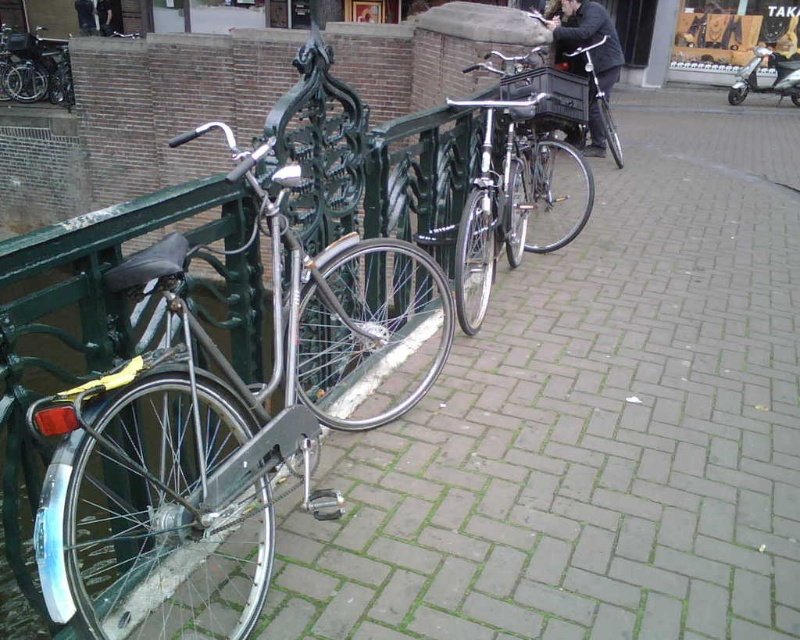
Does shiny silver bicycle at left have a greater width compared to black fabric jacket at upper center?

Correct, the width of shiny silver bicycle at left exceeds that of black fabric jacket at upper center.

Is point (256, 588) less distant than point (600, 120)?

Yes, point (256, 588) is closer to viewer.

Which is in front, point (156, 548) or point (601, 36)?

Positioned in front is point (156, 548).

Where is `shiny silver bicycle at left`? shiny silver bicycle at left is located at coordinates (216, 419).

Does shiny silver bicycle at center lie behind dark gray fabric pants at upper left?

No, it is in front of dark gray fabric pants at upper left.

Is shiny silver bicycle at center positioned before dark gray fabric pants at upper left?

Yes, it is in front of dark gray fabric pants at upper left.

Is point (584, 90) positioned after point (92, 8)?

That is False.

Locate an element on the screen. shiny silver bicycle at center is located at coordinates (514, 173).

Does black fabric jacket at upper center appear over dark gray fabric pants at upper left?

Incorrect, black fabric jacket at upper center is not positioned above dark gray fabric pants at upper left.

Locate an element on the screen. black fabric jacket at upper center is located at coordinates (590, 54).